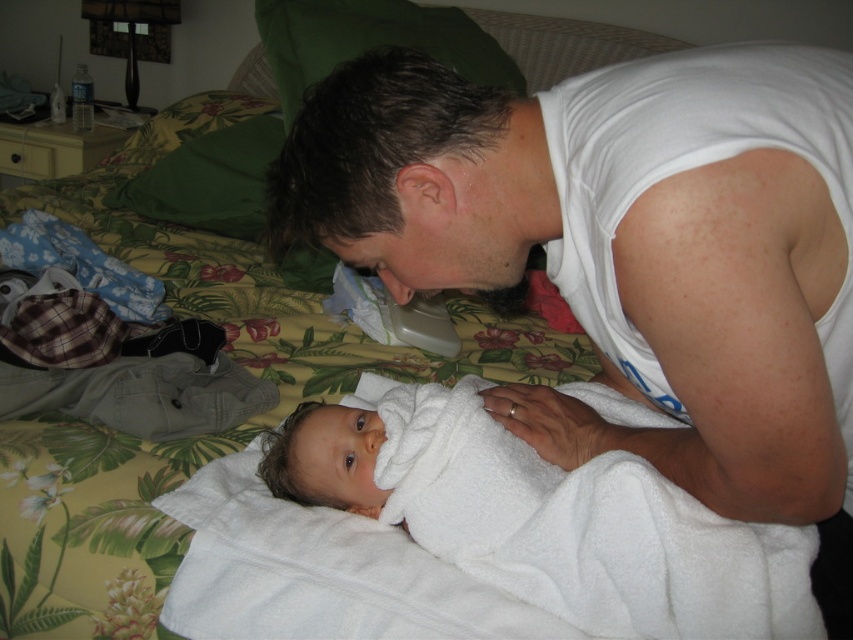
Question: Does white cotton tank top at upper right lie behind white soft towel at center?

Choices:
 (A) yes
 (B) no

Answer: (B)

Question: Which object appears farthest from the camera in this image?

Choices:
 (A) white soft towel at center
 (B) white cotton tank top at upper right

Answer: (A)

Question: Can you confirm if white cotton tank top at upper right is positioned below white soft towel at center?

Choices:
 (A) yes
 (B) no

Answer: (B)

Question: Can you confirm if white cotton tank top at upper right is wider than white soft towel at center?

Choices:
 (A) no
 (B) yes

Answer: (B)